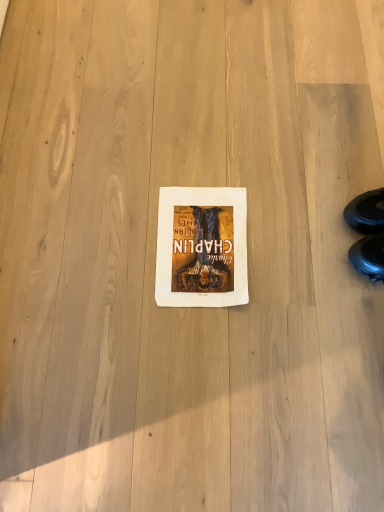
Question: Is black leather shoe at lower right positioned before white paper at center?

Choices:
 (A) no
 (B) yes

Answer: (B)

Question: Considering the relative positions of black leather shoe at lower right and white paper at center in the image provided, is black leather shoe at lower right to the left of white paper at center from the viewer's perspective?

Choices:
 (A) yes
 (B) no

Answer: (B)

Question: Could you tell me if black leather shoe at lower right is facing white paper at center?

Choices:
 (A) no
 (B) yes

Answer: (B)

Question: Is black leather shoe at lower right next to white paper at center and touching it?

Choices:
 (A) yes
 (B) no

Answer: (B)

Question: Is black leather shoe at lower right oriented away from white paper at center?

Choices:
 (A) yes
 (B) no

Answer: (B)

Question: Does black leather shoe at lower right have a larger size compared to white paper at center?

Choices:
 (A) no
 (B) yes

Answer: (B)

Question: Is black leather shoe at lower right completely or partially inside white paper at center?

Choices:
 (A) yes
 (B) no

Answer: (B)

Question: Is white paper at center in front of black leather shoe at lower right?

Choices:
 (A) yes
 (B) no

Answer: (B)

Question: Is white paper at center bigger than black leather shoe at lower right?

Choices:
 (A) no
 (B) yes

Answer: (A)

Question: Does white paper at center turn towards black leather shoe at lower right?

Choices:
 (A) no
 (B) yes

Answer: (A)

Question: Is white paper at center wider than black leather shoe at lower right?

Choices:
 (A) no
 (B) yes

Answer: (B)

Question: Would you say white paper at center is outside black leather shoe at lower right?

Choices:
 (A) no
 (B) yes

Answer: (B)

Question: Is black leather shoe at lower right wider or thinner than white paper at center?

Choices:
 (A) thin
 (B) wide

Answer: (A)